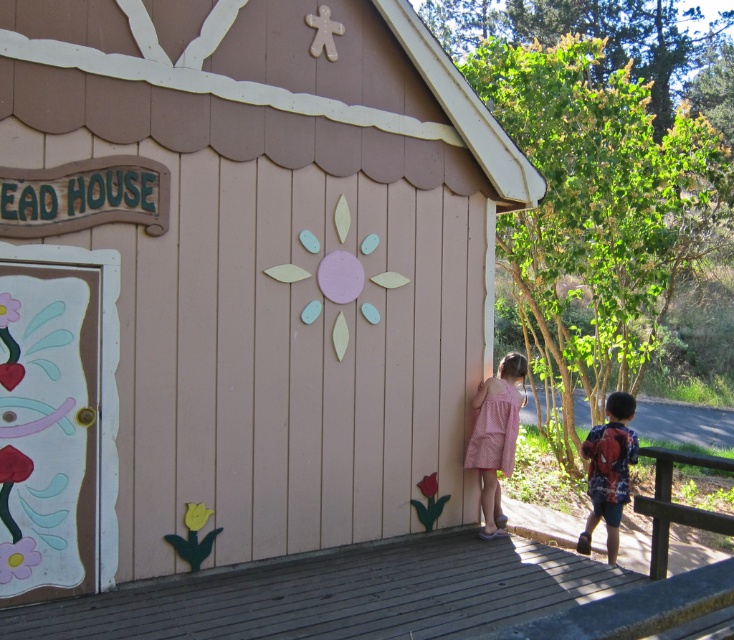
Who is positioned more to the left, wooden hut at center or red backpack at lower right?

Positioned to the left is wooden hut at center.

Does wooden hut at center appear on the left side of red backpack at lower right?

Yes, wooden hut at center is to the left of red backpack at lower right.

Locate an element on the screen. wooden hut at center is located at coordinates (236, 282).

How much distance is there between pink dotted dress at lower right and red backpack at lower right?

pink dotted dress at lower right is 30.97 inches away from red backpack at lower right.

Can you confirm if pink dotted dress at lower right is positioned to the left of red backpack at lower right?

Yes, pink dotted dress at lower right is to the left of red backpack at lower right.

Where is `pink dotted dress at lower right`? pink dotted dress at lower right is located at coordinates (495, 436).

The width and height of the screenshot is (734, 640). What are the coordinates of `wooden hut at center` in the screenshot? It's located at (236, 282).

Does wooden hut at center have a lesser height compared to pink dotted dress at lower right?

Incorrect, wooden hut at center's height does not fall short of pink dotted dress at lower right's.

Is point (305, 166) closer to camera compared to point (484, 476)?

Yes.

Identify the location of wooden hut at center. (236, 282).